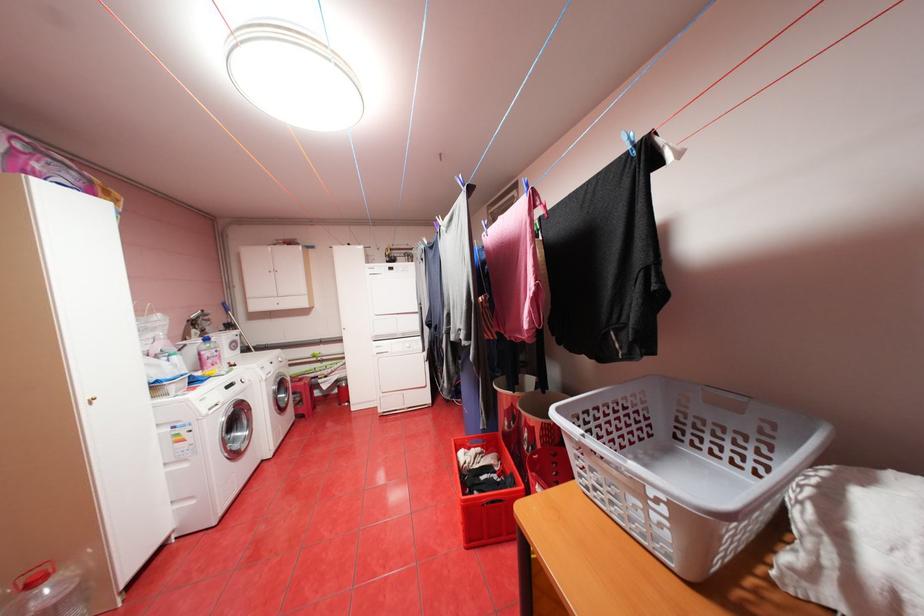
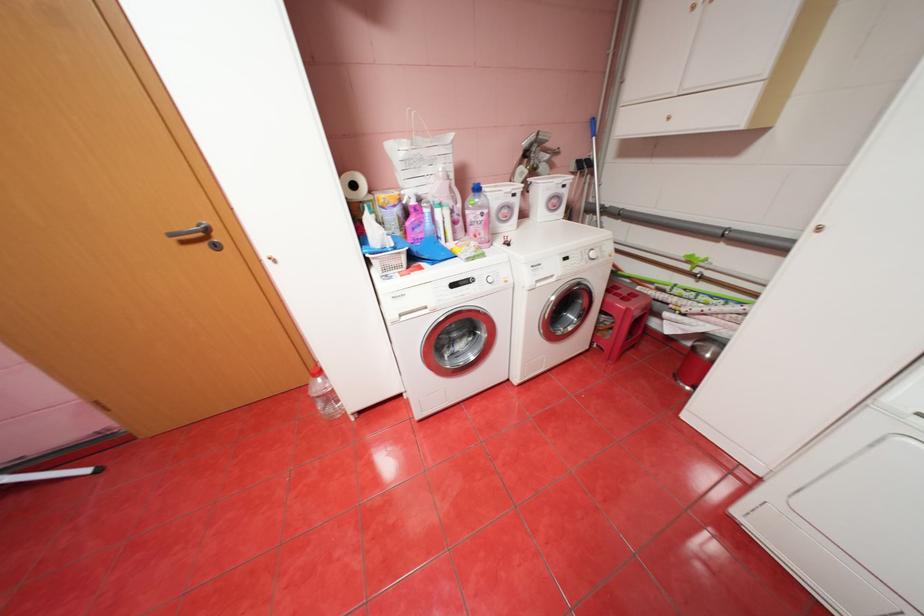
Find the pixel in the second image that matches (x=244, y=342) in the first image.

(566, 197)